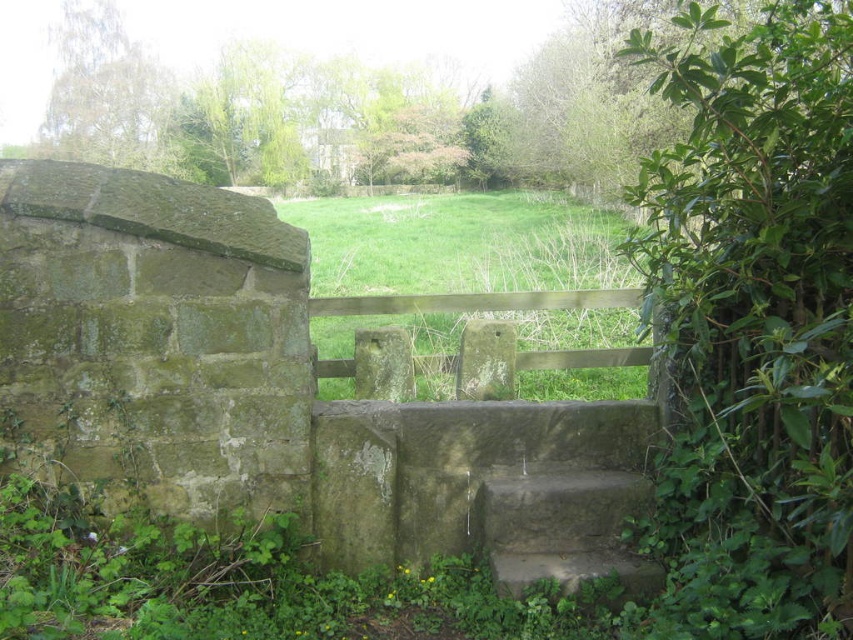
Between green mossy stone wall at left and brown wooden rail at center, which one has less height?

With less height is brown wooden rail at center.

Can you confirm if green mossy stone wall at left is thinner than brown wooden rail at center?

Yes.

Between point (260, 298) and point (512, 340), which one is positioned in front?

Positioned in front is point (260, 298).

You are a GUI agent. You are given a task and a screenshot of the screen. Output one action in this format:
    pyautogui.click(x=<x>, y=<y>)
    Task: Click on the green mossy stone wall at left
    Image resolution: width=853 pixels, height=640 pixels.
    Given the screenshot: What is the action you would take?
    pyautogui.click(x=155, y=339)

Does point (534, 333) come behind point (541, 568)?

Yes, it is behind point (541, 568).

Between point (543, 376) and point (515, 548), which one is positioned in front?

Positioned in front is point (515, 548).

Does point (461, 321) come behind point (555, 582)?

Yes, point (461, 321) is farther from viewer.

Where is `green grass at center`? The image size is (853, 640). green grass at center is located at coordinates (459, 243).

In the scene shown: Can you confirm if green mossy stone wall at left is positioned to the left of stone textured stair at center?

Correct, you'll find green mossy stone wall at left to the left of stone textured stair at center.

Who is more distant from viewer, (100, 177) or (621, 570)?

The point (621, 570) is more distant.

The width and height of the screenshot is (853, 640). In order to click on green mossy stone wall at left in this screenshot , I will do `click(155, 339)`.